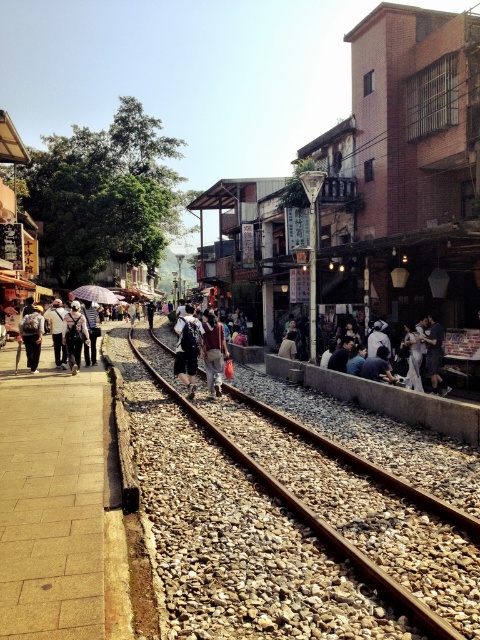
Question: Which object is positioned farthest from the light brown leather jacket at lower right?

Choices:
 (A) purple matte umbrella at center
 (B) matte black backpack at left

Answer: (A)

Question: Where is denim jacket at center located in relation to light brown leather jacket at lower right in the image?

Choices:
 (A) right
 (B) left

Answer: (B)

Question: Which point is farther to the camera?

Choices:
 (A) denim jacket at center
 (B) matte black backpack at left

Answer: (B)

Question: Does matte black backpack at left appear on the left side of purple matte umbrella at center?

Choices:
 (A) no
 (B) yes

Answer: (A)

Question: Is matte gray shirt at center closer to camera compared to matte black backpack at left?

Choices:
 (A) no
 (B) yes

Answer: (B)

Question: Estimate the real-world distances between objects in this image. Which object is farther from the matte gray shirt at center?

Choices:
 (A) light brown leather jacket at lower right
 (B) denim jacket at center

Answer: (B)